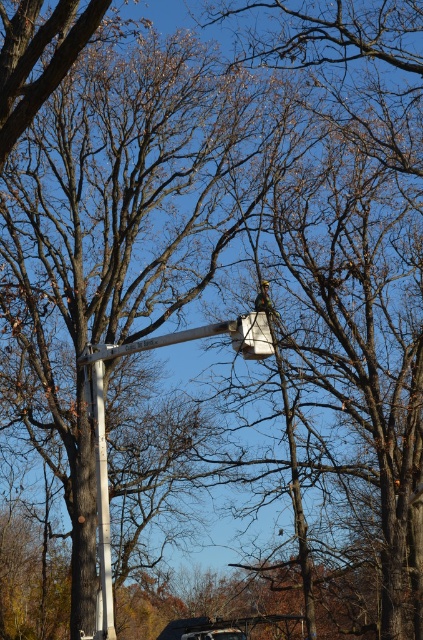
Question: Can you confirm if white metallic street light at upper center is positioned to the left of white plastic pole at center?

Choices:
 (A) yes
 (B) no

Answer: (B)

Question: Is white metallic street light at upper center further to the viewer compared to white plastic pole at center?

Choices:
 (A) no
 (B) yes

Answer: (A)

Question: Is white metallic street light at upper center to the left of white plastic pole at center from the viewer's perspective?

Choices:
 (A) no
 (B) yes

Answer: (A)

Question: Which point is closer to the camera taking this photo?

Choices:
 (A) (246, 316)
 (B) (98, 442)

Answer: (A)

Question: Among these objects, which one is nearest to the camera?

Choices:
 (A) white plastic pole at center
 (B) white metallic street light at upper center

Answer: (B)